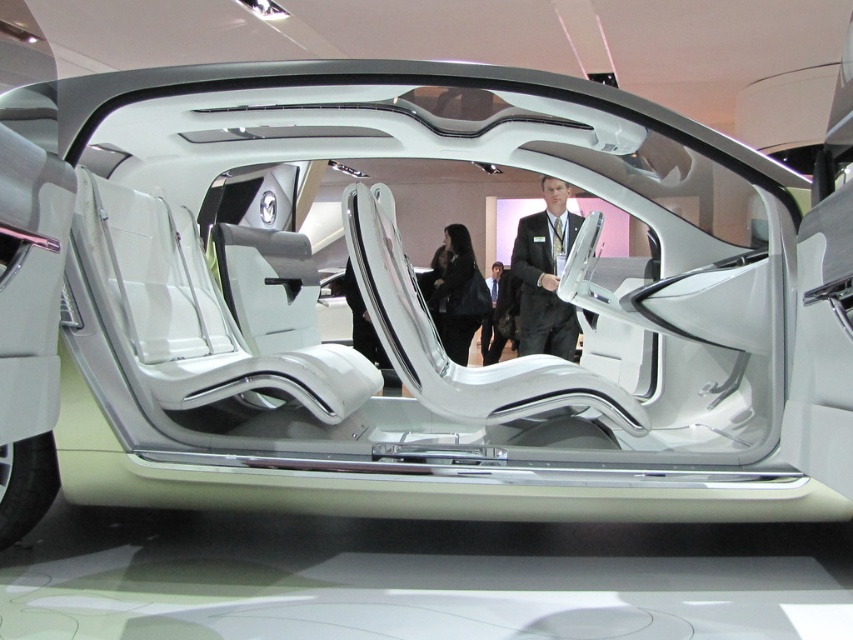
Question: Does black suit at center lie behind dark suit at center?

Choices:
 (A) no
 (B) yes

Answer: (A)

Question: Which object appears farthest from the camera in this image?

Choices:
 (A) black suit at center
 (B) dark suit at center

Answer: (B)

Question: Can you confirm if black suit at center is positioned to the left of dark suit at center?

Choices:
 (A) no
 (B) yes

Answer: (B)

Question: Which point is farther from the camera taking this photo?

Choices:
 (A) (550, 250)
 (B) (480, 333)

Answer: (B)

Question: Does black suit at center lie behind dark suit at center?

Choices:
 (A) yes
 (B) no

Answer: (B)